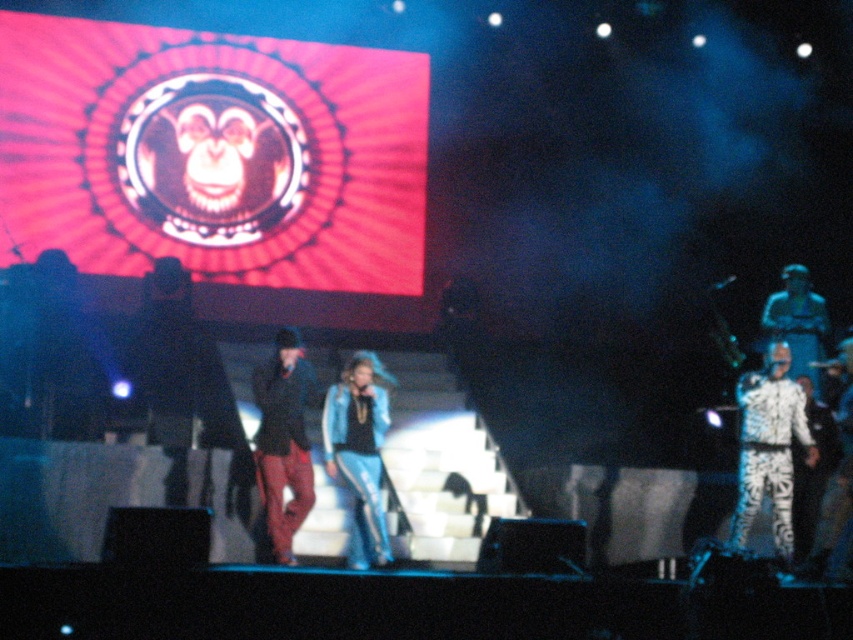
Is point (755, 397) less distant than point (370, 380)?

Yes, it is in front of point (370, 380).

Can you confirm if white zebra-patterned suit at right is shorter than blue denim jacket at center?

Incorrect, white zebra-patterned suit at right's height does not fall short of blue denim jacket at center's.

Is point (759, 396) farther from camera compared to point (366, 417)?

No, (759, 396) is in front of (366, 417).

Where is `white zebra-patterned suit at right`? white zebra-patterned suit at right is located at coordinates (769, 449).

Which is more to the right, white zebra-patterned suit at right or white printed pants at right?

Positioned to the right is white printed pants at right.

How far apart are white zebra-patterned suit at right and white printed pants at right?

2.47 meters

Is point (756, 436) positioned before point (804, 364)?

Yes.

This screenshot has height=640, width=853. I want to click on white zebra-patterned suit at right, so click(x=769, y=449).

Which is below, matte black jacket at center or white printed pants at right?

matte black jacket at center is lower down.

Does point (283, 442) come farther from viewer compared to point (793, 278)?

No, (283, 442) is closer to viewer.

Identify the location of matte black jacket at center. Image resolution: width=853 pixels, height=640 pixels. (282, 444).

At what (x,y) coordinates should I click in order to perform the action: click on matte black jacket at center. Please return your answer as a coordinate pair (x, y). Looking at the image, I should click on (282, 444).